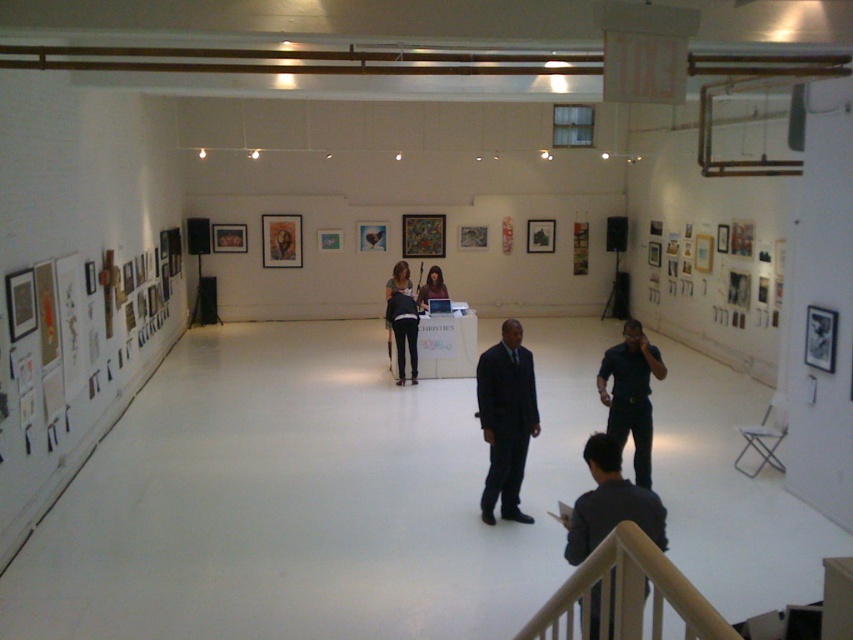
You are standing in the art gallery and want to move from the entrance to the exit. The entrance is near point A at point (490, 372) and the exit is near point B at point (426, 301). Given that you can only walk straight towards the exit, will you pass directly in front of point A before reaching point B?

Point A at point (490, 372) is in front of point B at point (426, 301). Therefore, if you walk straight towards the exit near point B, you will first pass directly in front of point A before reaching point B.

You are an art gallery visitor wearing a dark blue shirt at lower center and a dark blue suit at center. Which clothing item is closer to the entrance of the gallery?

The dark blue shirt at lower center is behind the dark blue suit at center, so the suit is closer to the entrance than the shirt.